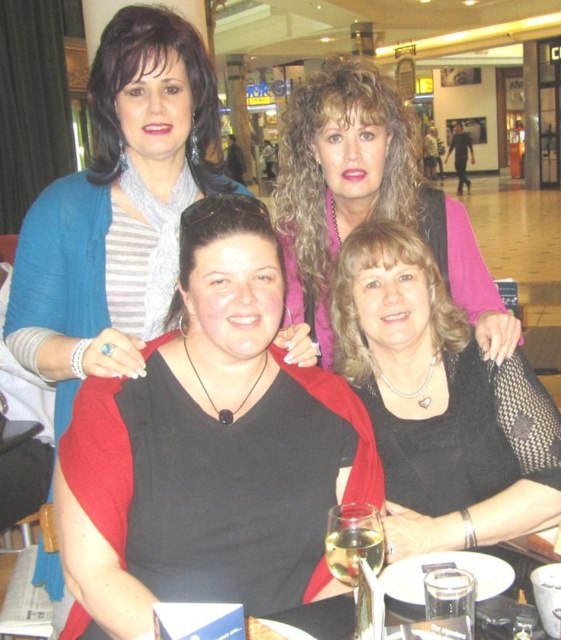
Question: Based on their relative distances, which object is farther from the matte pink sweater at upper center?

Choices:
 (A) black matte dress at center
 (B) black matte shirt at center

Answer: (B)

Question: Is black matte dress at center thinner than matte pink sweater at upper center?

Choices:
 (A) no
 (B) yes

Answer: (B)

Question: Estimate the real-world distances between objects in this image. Which object is farther from the black matte dress at center?

Choices:
 (A) matte pink sweater at upper center
 (B) black matte shirt at center

Answer: (B)

Question: Is black matte shirt at center in front of black matte dress at center?

Choices:
 (A) yes
 (B) no

Answer: (A)

Question: Is black matte shirt at center smaller than matte pink sweater at upper center?

Choices:
 (A) yes
 (B) no

Answer: (A)

Question: Which point is farther from the camera taking this photo?

Choices:
 (A) (493, 531)
 (B) (251, 262)
 (C) (324, 122)

Answer: (C)